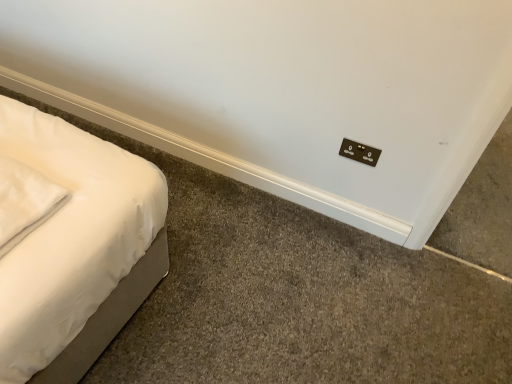
Question: From a real-world perspective, is brown matte electric outlet at upper right on top of white soft pillow at left?

Choices:
 (A) no
 (B) yes

Answer: (A)

Question: Can you confirm if brown matte electric outlet at upper right is positioned to the left of white soft pillow at left?

Choices:
 (A) yes
 (B) no

Answer: (B)

Question: Is brown matte electric outlet at upper right shorter than white soft pillow at left?

Choices:
 (A) no
 (B) yes

Answer: (A)

Question: Is brown matte electric outlet at upper right turned away from white soft pillow at left?

Choices:
 (A) no
 (B) yes

Answer: (A)

Question: From a real-world perspective, is brown matte electric outlet at upper right below white soft pillow at left?

Choices:
 (A) no
 (B) yes

Answer: (B)

Question: Is brown matte electric outlet at upper right beside white soft pillow at left?

Choices:
 (A) yes
 (B) no

Answer: (B)

Question: Is white soft pillow at left turned away from brown matte electric outlet at upper right?

Choices:
 (A) no
 (B) yes

Answer: (A)

Question: Is white soft pillow at left bigger than brown matte electric outlet at upper right?

Choices:
 (A) no
 (B) yes

Answer: (B)

Question: Considering the relative sizes of white soft pillow at left and brown matte electric outlet at upper right in the image provided, is white soft pillow at left wider than brown matte electric outlet at upper right?

Choices:
 (A) yes
 (B) no

Answer: (A)

Question: From the image's perspective, is white soft pillow at left on brown matte electric outlet at upper right?

Choices:
 (A) yes
 (B) no

Answer: (B)

Question: Is white soft pillow at left positioned beyond the bounds of brown matte electric outlet at upper right?

Choices:
 (A) yes
 (B) no

Answer: (A)

Question: Considering the relative sizes of white soft pillow at left and brown matte electric outlet at upper right in the image provided, is white soft pillow at left thinner than brown matte electric outlet at upper right?

Choices:
 (A) no
 (B) yes

Answer: (A)

Question: Is brown matte electric outlet at upper right bigger or smaller than white soft pillow at left?

Choices:
 (A) big
 (B) small

Answer: (B)